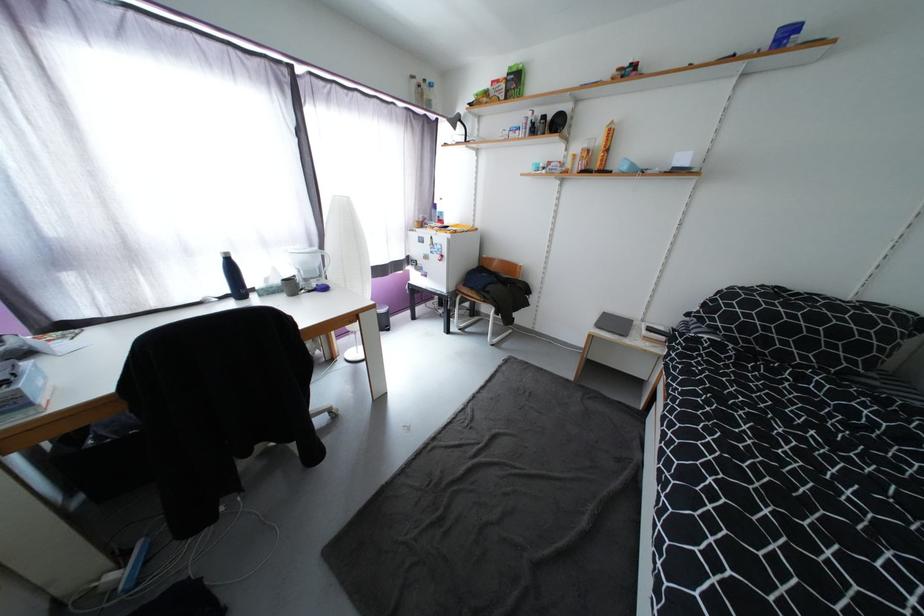
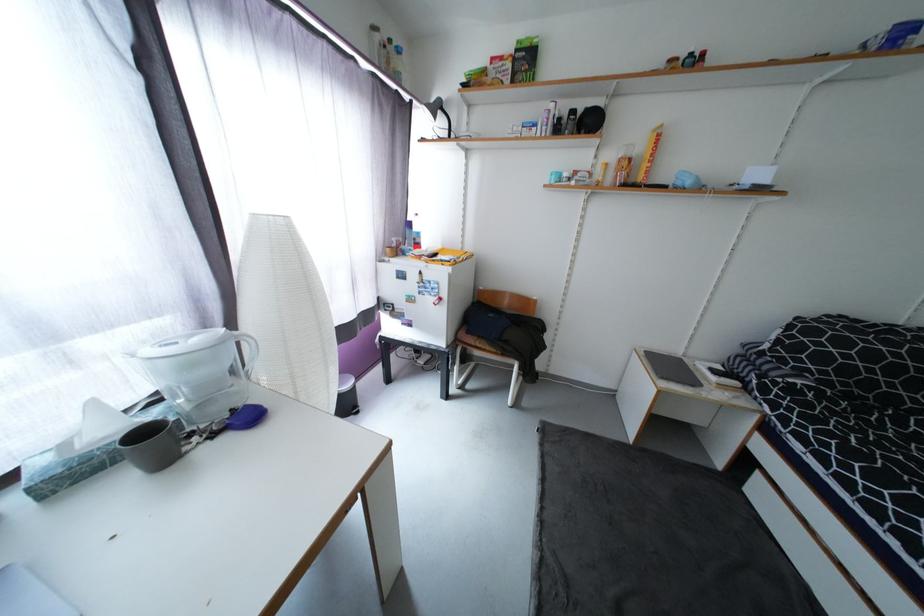
Find the pixel in the second image that matches (x=508, y=87) in the first image.

(515, 66)